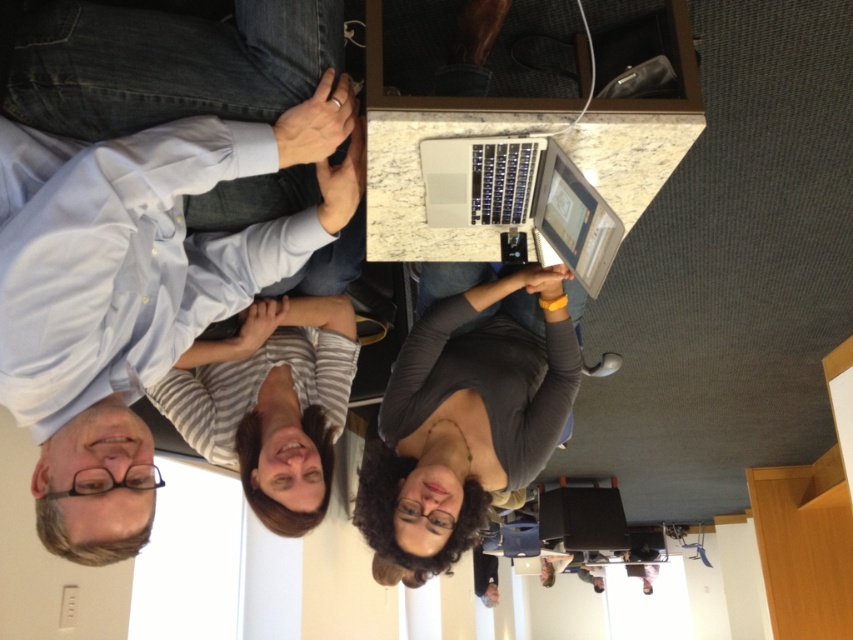
You are trying to determine the spatial relationship between the light blue shirt at upper left and the sleek silver laptop at center in the rotated image. Based on the scene description, which object is positioned lower in the image?

The light blue shirt at upper left is located below the sleek silver laptop at center, so it is positioned lower in the image.

You are standing at the center of the rotated scene and want to reach the light blue shirt at upper left. Which direction should you move to get closer to it?

Since the scene is rotated 90 degrees clockwise, the light blue shirt at upper left is actually to your right when facing the original orientation. However, considering the rotated perspective, moving towards the upper left direction in the rotated image would bring you closer to the light blue shirt at upper left.